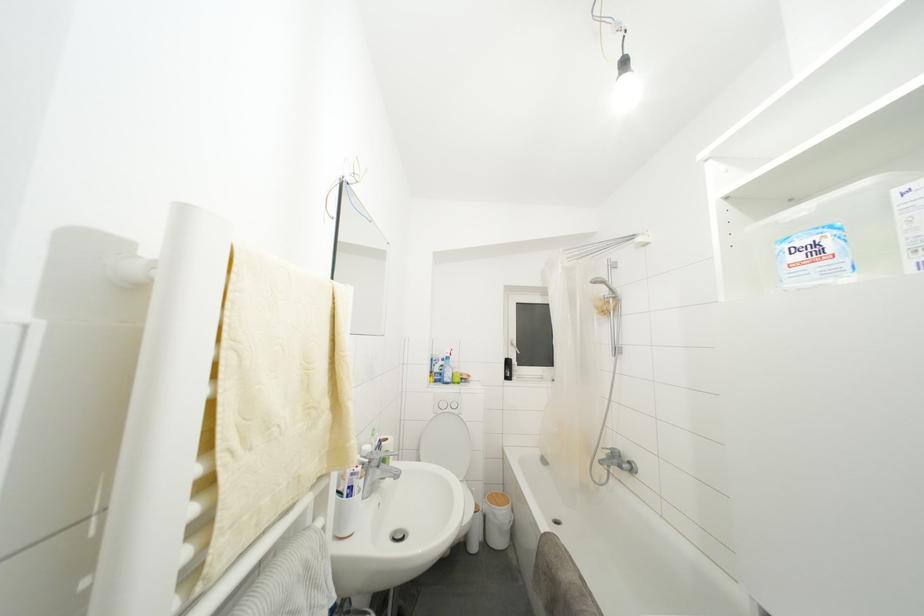
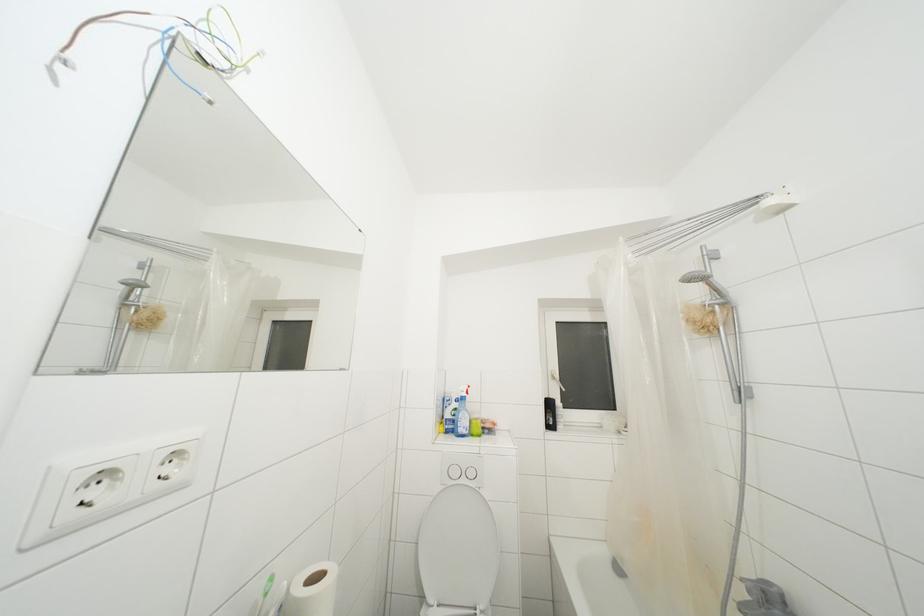
Question: What movement of the cameraman would produce the second image?

Choices:
 (A) Left
 (B) Right
 (C) Forward
 (D) Backward

Answer: (C)